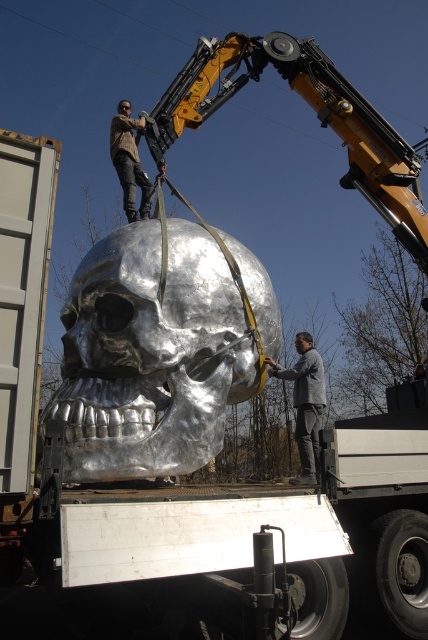
Does shiny metallic skull at center have a smaller size compared to gray fabric jacket at right?

No, shiny metallic skull at center is not smaller than gray fabric jacket at right.

Can you confirm if shiny metallic skull at center is positioned to the left of gray fabric jacket at right?

Yes, shiny metallic skull at center is to the left of gray fabric jacket at right.

Describe the element at coordinates (151, 355) in the screenshot. Image resolution: width=428 pixels, height=640 pixels. I see `shiny metallic skull at center` at that location.

Locate an element on the screen. shiny metallic skull at center is located at coordinates (151, 355).

Does point (211, 301) lie behind point (133, 186)?

No.

Is shiny metallic skull at center smaller than brown leather jacket at upper center?

Correct, shiny metallic skull at center occupies less space than brown leather jacket at upper center.

Does point (166, 344) come closer to viewer compared to point (124, 184)?

Yes, it is in front of point (124, 184).

The image size is (428, 640). I want to click on shiny metallic skull at center, so click(x=151, y=355).

Image resolution: width=428 pixels, height=640 pixels. What do you see at coordinates (305, 403) in the screenshot?
I see `gray fabric jacket at right` at bounding box center [305, 403].

Can you confirm if gray fabric jacket at right is positioned to the right of brown leather jacket at upper center?

Indeed, gray fabric jacket at right is positioned on the right side of brown leather jacket at upper center.

Which is in front, point (306, 342) or point (128, 180)?

Point (128, 180) is in front.

The image size is (428, 640). I want to click on gray fabric jacket at right, so click(305, 403).